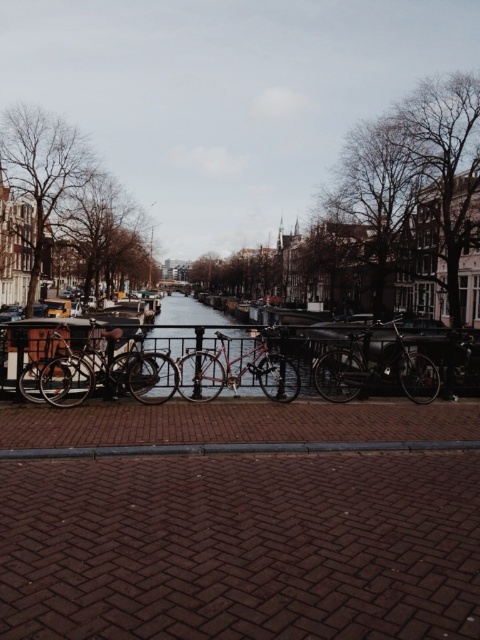
Is shiny black bicycle at center to the left of shiny red bicycle at center from the viewer's perspective?

No, shiny black bicycle at center is not to the left of shiny red bicycle at center.

Does shiny black bicycle at center have a greater width compared to shiny red bicycle at center?

Yes, shiny black bicycle at center is wider than shiny red bicycle at center.

Is point (430, 360) in front of point (189, 362)?

No, (430, 360) is further to viewer.

Locate an element on the screen. Image resolution: width=480 pixels, height=640 pixels. shiny black bicycle at center is located at coordinates (374, 371).

Is point (177, 330) closer to camera compared to point (228, 369)?

No, it is behind (228, 369).

Where is `metallic waterway at center`? This screenshot has width=480, height=640. metallic waterway at center is located at coordinates (226, 362).

Does metallic waterway at center lie in front of shiny metallic bicycle at center?

No, it is behind shiny metallic bicycle at center.

Does metallic waterway at center have a greater width compared to shiny metallic bicycle at center?

Correct, the width of metallic waterway at center exceeds that of shiny metallic bicycle at center.

Who is more forward, (273,353) or (83,362)?

Point (83,362) is in front.

You are a GUI agent. You are given a task and a screenshot of the screen. Output one action in this format:
    pyautogui.click(x=<x>, y=<y>)
    Task: Click on the metallic waterway at center
    
    Given the screenshot: What is the action you would take?
    pyautogui.click(x=226, y=362)